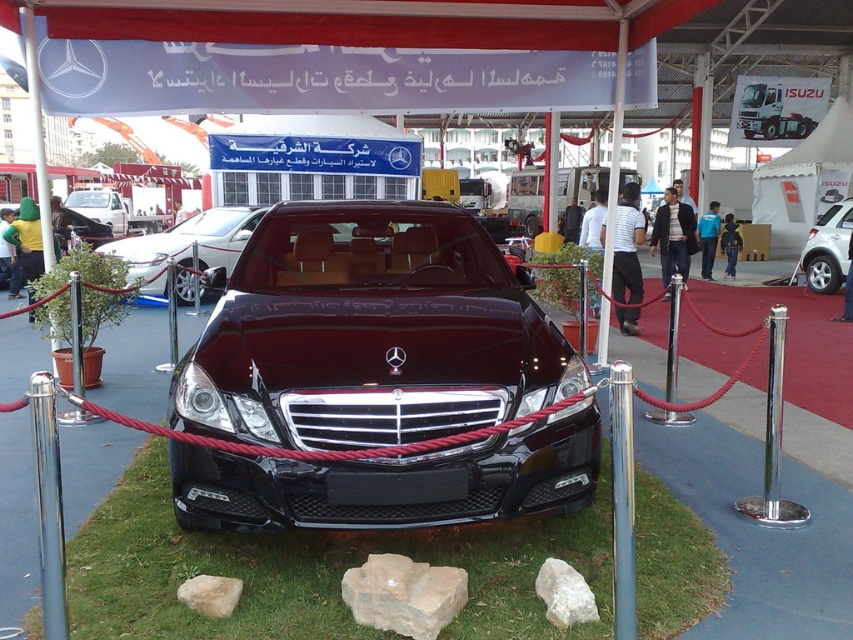
Question: Considering the real-world distances, which object is farthest from the glossy black car at center?

Choices:
 (A) white glossy truck at left
 (B) silver metallic sedan at center
 (C) white smooth rock at lower center

Answer: (A)

Question: In this image, where is glossy black car at center located relative to light beige stone at lower center?

Choices:
 (A) right
 (B) left

Answer: (B)

Question: Among these points, which one is nearest to the camera?

Choices:
 (A) (248, 337)
 (B) (239, 596)
 (C) (88, 195)

Answer: (B)

Question: Can you confirm if green grass at center is positioned to the left of light beige stone at lower center?

Choices:
 (A) yes
 (B) no

Answer: (A)

Question: Does glossy black car at center have a smaller size compared to green grass at center?

Choices:
 (A) yes
 (B) no

Answer: (B)

Question: Which object is farther from the camera taking this photo?

Choices:
 (A) white glossy truck at left
 (B) white smooth rock at lower center

Answer: (A)